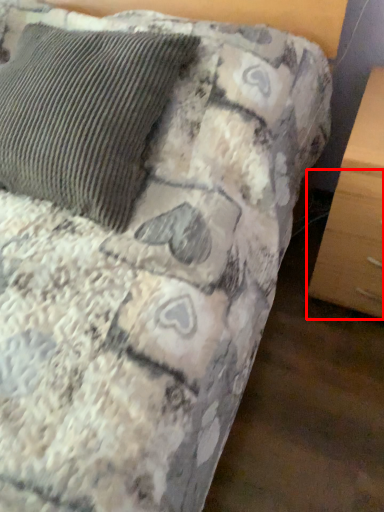
Question: From the image's perspective, what is the correct spatial relationship of drawer (annotated by the red box) in relation to pillow?

Choices:
 (A) below
 (B) above

Answer: (A)